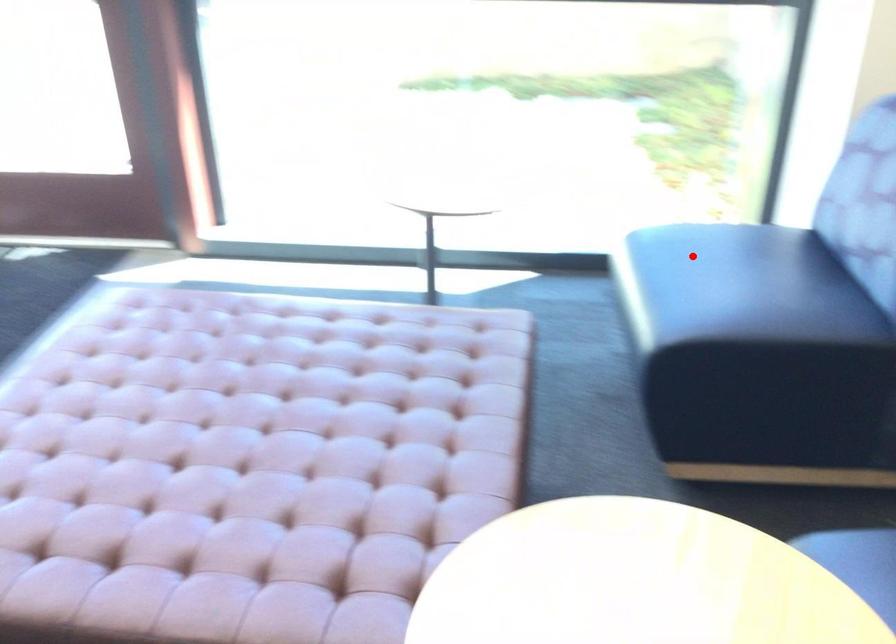
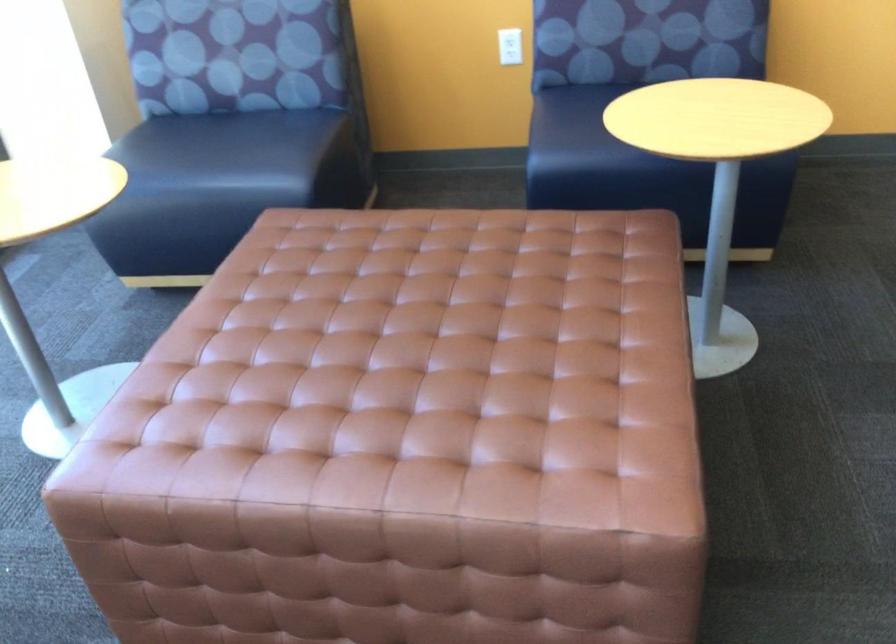
Question: I am providing you with two images of the same scene from different viewpoints. In image1, a red point is highlighted. Considering the same 3D point in image2, which of the following is correct?

Choices:
 (A) It is closer
 (B) It is farther

Answer: (B)